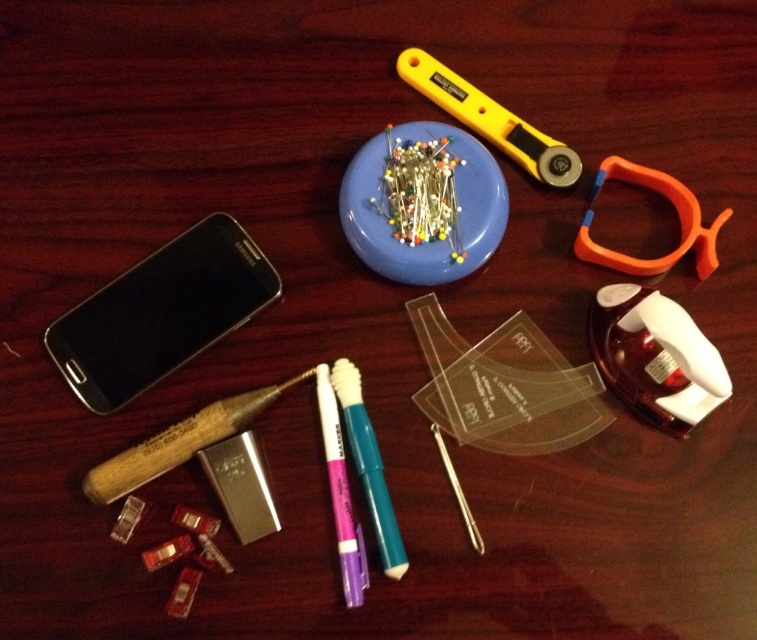
You are organizing a craft kit and need to place the blue plastic plate at center and orange plastic scissors at upper right into a storage box. The box has a height limit of 10 cm. Can both items fit vertically without exceeding the height limit?

The blue plastic plate at center is much taller than the orange plastic scissors at upper right. If the blue plastic plate at center exceeds 10 cm in height, it would not fit, but if it is under 10 cm, both can fit. However, since the exact height isn

You are standing at the origin point in the image. Which of the two points, point (684, 244) or point (321, 381), is closer to you?

Point (684, 244) is closer to you because it is in front of point (321, 381).

You are organizing the sewing tools on the dark wooden surface. You need to place the wooden handle tool at lower left and the orange plastic scissors at upper right. Which object is closer to you when viewed from above?

The wooden handle tool at lower left is closer to you because it is in front of the orange plastic scissors at upper right.